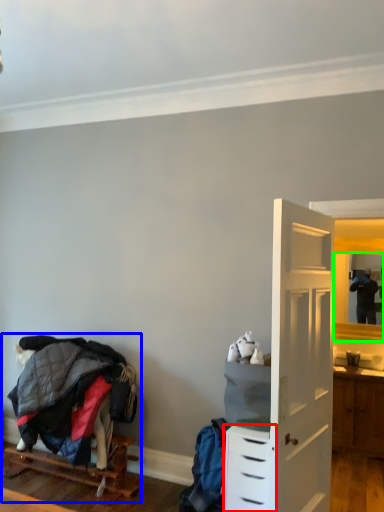
Question: Which is nearer to the chest of drawers (highlighted by a red box)? bunk bed (highlighted by a blue box) or mirror (highlighted by a green box).

Choices:
 (A) bunk bed
 (B) mirror

Answer: (A)